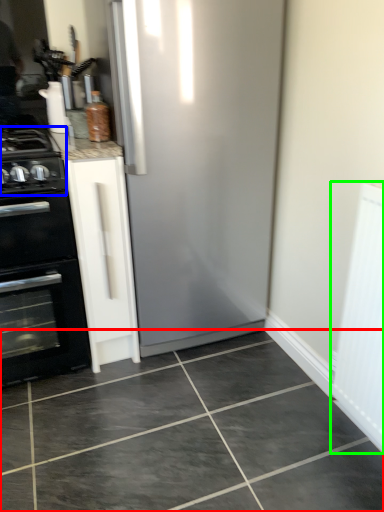
Question: Which is farther away from ceramic tile (highlighted by a red box)? gas stove (highlighted by a blue box) or screen door (highlighted by a green box)?

Choices:
 (A) gas stove
 (B) screen door

Answer: (A)